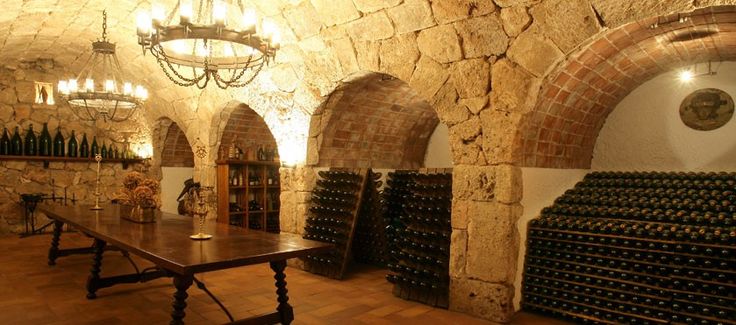
Locate an element on the screen. floor is located at coordinates (436, 318).